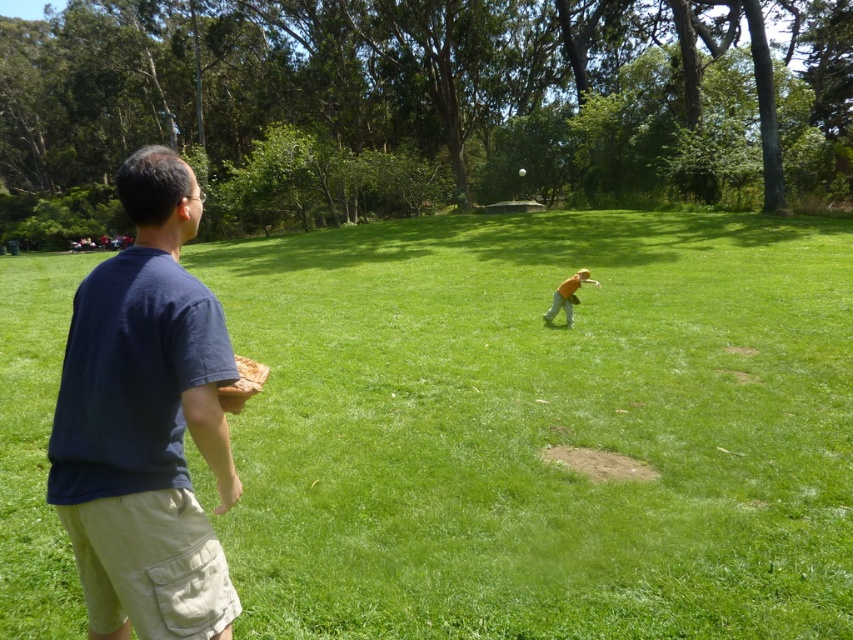
This screenshot has height=640, width=853. I want to click on brown leather glove at center, so click(x=573, y=300).

Who is higher up, brown leather glove at center or white matte baseball at center?

white matte baseball at center is higher up.

Between point (572, 296) and point (521, 172), which one is positioned in front?

Positioned in front is point (572, 296).

Where is `brown leather glove at center`? brown leather glove at center is located at coordinates click(573, 300).

Is point (508, 390) closer to camera compared to point (566, 320)?

Yes, it is in front of point (566, 320).

Does green grassy field at center have a lesser width compared to orange cotton shirt at center?

No.

Who is more forward, [654,618] or [567,305]?

Point [654,618]

Locate an element on the screen. The width and height of the screenshot is (853, 640). green grassy field at center is located at coordinates point(541,428).

Does green grassy field at center appear under brown leather glove at center?

Actually, green grassy field at center is above brown leather glove at center.

Can you confirm if green grassy field at center is bigger than brown leather glove at center?

Correct, green grassy field at center is larger in size than brown leather glove at center.

Does point (695, 308) come closer to viewer compared to point (573, 296)?

No.

The width and height of the screenshot is (853, 640). Identify the location of green grassy field at center. pos(541,428).